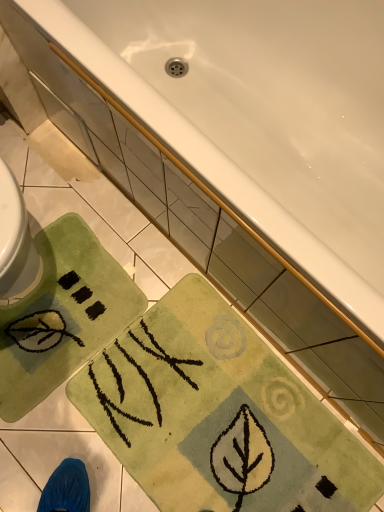
Identify the location of vacant area on top of green soft rug at lower left, positioned as the 1th beach towel in left-to-right order (from a real-world perspective). (47, 311).